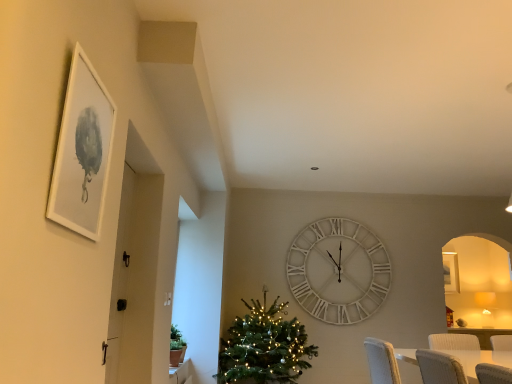
Question: Considering the relative sizes of white matte picture frame at upper left and green matte christmas tree at center in the image provided, is white matte picture frame at upper left wider than green matte christmas tree at center?

Choices:
 (A) yes
 (B) no

Answer: (B)

Question: Considering the relative sizes of white matte picture frame at upper left and green matte christmas tree at center in the image provided, is white matte picture frame at upper left thinner than green matte christmas tree at center?

Choices:
 (A) yes
 (B) no

Answer: (A)

Question: Does white matte picture frame at upper left come behind green matte christmas tree at center?

Choices:
 (A) yes
 (B) no

Answer: (B)

Question: Does white matte picture frame at upper left turn towards green matte christmas tree at center?

Choices:
 (A) yes
 (B) no

Answer: (B)

Question: Can you confirm if white matte picture frame at upper left is smaller than green matte christmas tree at center?

Choices:
 (A) no
 (B) yes

Answer: (B)

Question: Based on their sizes in the image, would you say green matte christmas tree at center is bigger or smaller than white matte picture frame at upper left?

Choices:
 (A) big
 (B) small

Answer: (A)

Question: Considering the positions of green matte christmas tree at center and white matte picture frame at upper left in the image, is green matte christmas tree at center wider or thinner than white matte picture frame at upper left?

Choices:
 (A) thin
 (B) wide

Answer: (B)

Question: Considering the positions of point (311, 357) and point (101, 180), is point (311, 357) closer or farther from the camera than point (101, 180)?

Choices:
 (A) closer
 (B) farther

Answer: (B)

Question: From the image's perspective, is green matte christmas tree at center positioned above or below white matte picture frame at upper left?

Choices:
 (A) above
 (B) below

Answer: (B)

Question: Looking at their shapes, would you say white wooden clock at center is wider or thinner than green matte christmas tree at center?

Choices:
 (A) wide
 (B) thin

Answer: (B)

Question: From the image's perspective, is white wooden clock at center located above or below green matte christmas tree at center?

Choices:
 (A) above
 (B) below

Answer: (A)

Question: Is white wooden clock at center situated inside green matte christmas tree at center or outside?

Choices:
 (A) outside
 (B) inside

Answer: (A)

Question: In terms of size, does white wooden clock at center appear bigger or smaller than green matte christmas tree at center?

Choices:
 (A) small
 (B) big

Answer: (A)

Question: Is point (234, 340) positioned closer to the camera than point (321, 317)?

Choices:
 (A) farther
 (B) closer

Answer: (B)

Question: Considering the positions of green matte christmas tree at center and white wooden clock at center in the image, is green matte christmas tree at center bigger or smaller than white wooden clock at center?

Choices:
 (A) small
 (B) big

Answer: (B)